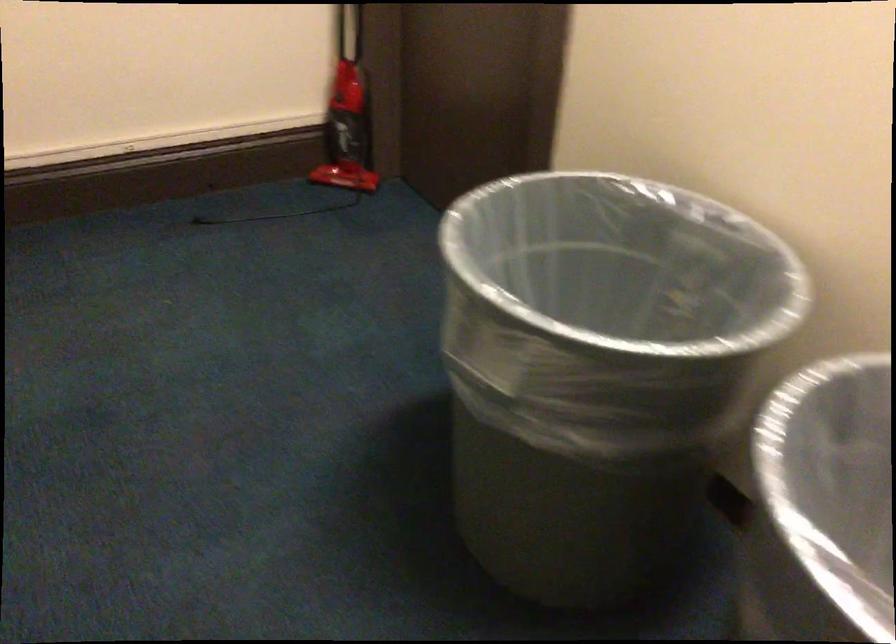
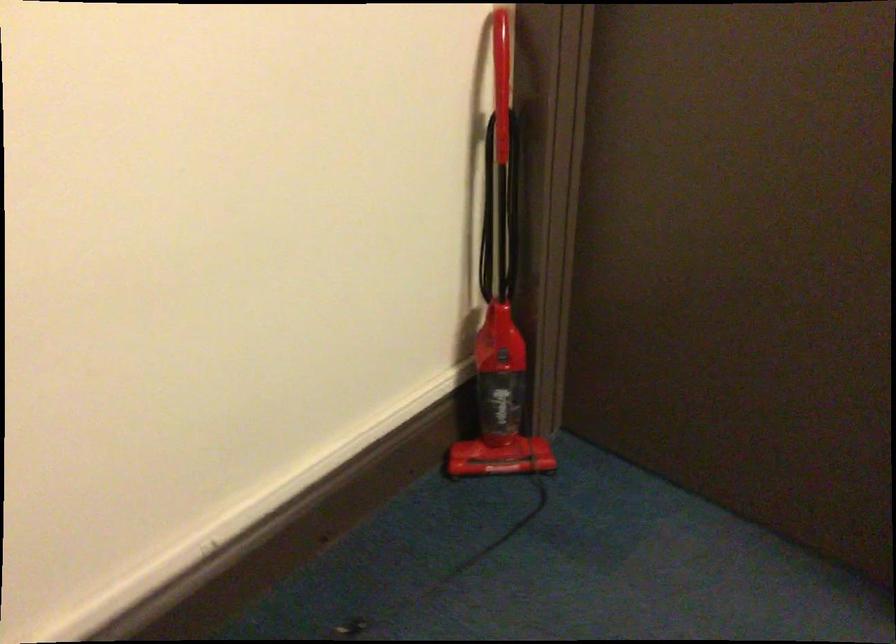
In a continuous first-person perspective shot, in which direction is the camera moving?

The cameraman moved toward left, forward.